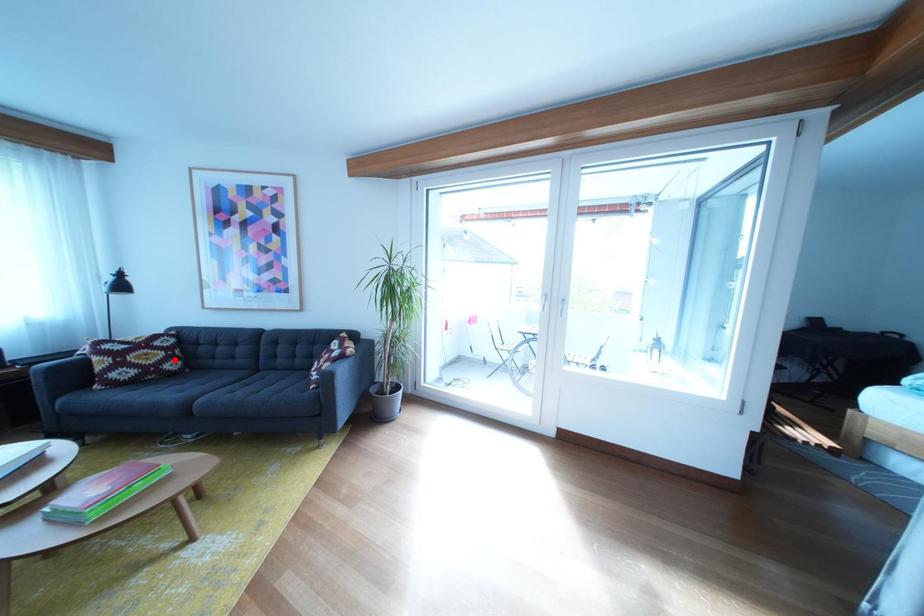
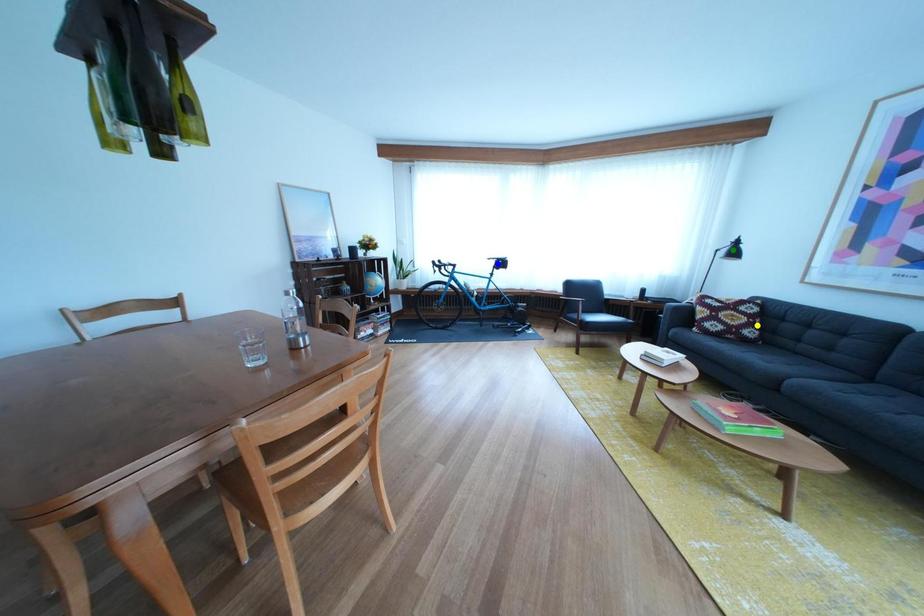
Question: I am providing you with two images of the same scene from different viewpoints. A red point is marked on the first image. You are given multiple points on the second image. Which mark in image 2 goes with the point in image 1?

Choices:
 (A) yellow point
 (B) green point
 (C) blue point

Answer: (A)